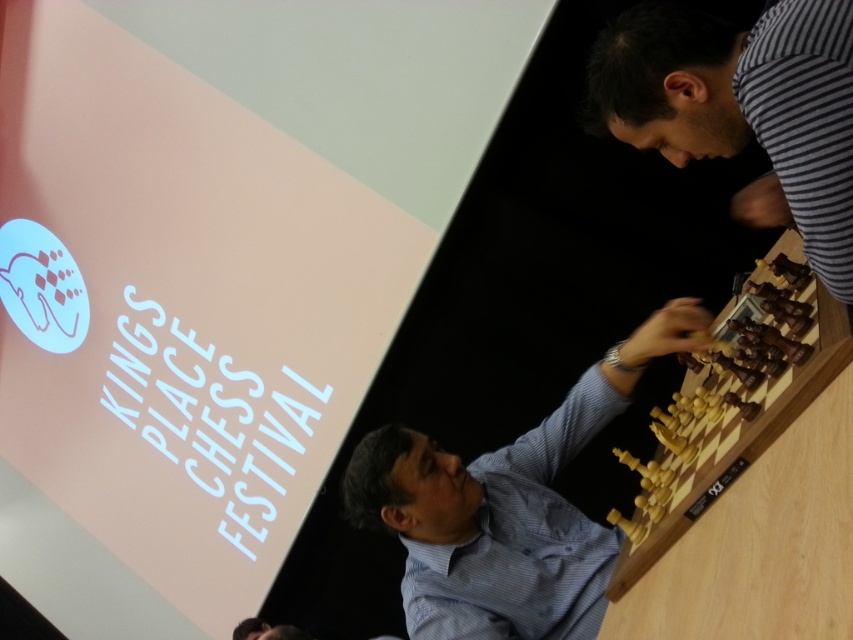
Can you confirm if striped fabric at upper right is positioned to the right of striped cotton shirt at upper right?

No, striped fabric at upper right is not to the right of striped cotton shirt at upper right.

Which is below, striped fabric at upper right or striped cotton shirt at upper right?

striped cotton shirt at upper right

Where is `striped fabric at upper right`? The width and height of the screenshot is (853, 640). striped fabric at upper right is located at coordinates (744, 109).

What are the coordinates of `striped fabric at upper right` in the screenshot? It's located at (744, 109).

Which is behind, point (537, 620) or point (773, 332)?

The point (537, 620) is behind.

Between light brown wood chess set at center and light wood chess set at right, which one has less height?

With less height is light wood chess set at right.

Who is more distant from viewer, (581, 627) or (653, 488)?

The point (581, 627) is more distant.

At what (x,y) coordinates should I click in order to perform the action: click on light brown wood chess set at center. Please return your answer as a coordinate pair (x, y). Image resolution: width=853 pixels, height=640 pixels. Looking at the image, I should click on (508, 508).

Is light brown wood chess set at center further to camera compared to striped fabric at upper right?

Yes, it is.

Between light brown wood chess set at center and striped fabric at upper right, which one has more height?

Standing taller between the two is light brown wood chess set at center.

This screenshot has height=640, width=853. Describe the element at coordinates (508, 508) in the screenshot. I see `light brown wood chess set at center` at that location.

Identify the location of light brown wood chess set at center. (508, 508).